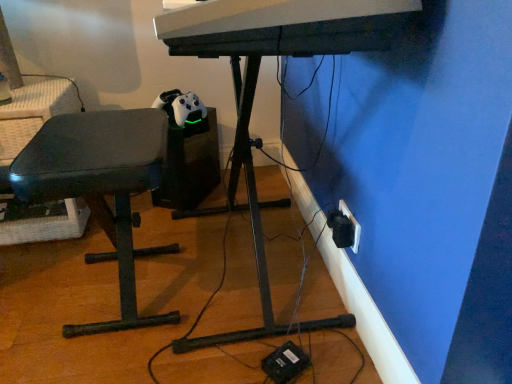
Question: From the image's perspective, relative to matte black bench at left, is white plastic computer desk at center above or below?

Choices:
 (A) below
 (B) above

Answer: (B)

Question: Considering the positions of white plastic computer desk at center and matte black bench at left in the image, is white plastic computer desk at center wider or thinner than matte black bench at left?

Choices:
 (A) thin
 (B) wide

Answer: (B)

Question: Considering the real-world distances, which object is farthest from the white plastic electric outlet at lower right?

Choices:
 (A) white plastic computer desk at center
 (B) white plastic musical keyboard at upper center
 (C) matte black bench at left

Answer: (C)

Question: Estimate the real-world distances between objects in this image. Which object is closer to the white plastic electric outlet at lower right?

Choices:
 (A) matte black bench at left
 (B) white plastic musical keyboard at upper center
 (C) white plastic computer desk at center

Answer: (C)